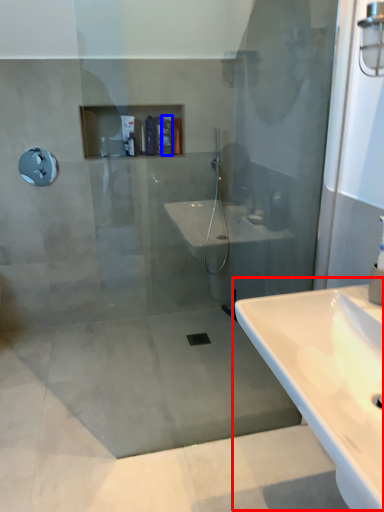
Question: Which of the following is the farthest to the observer, sink (highlighted by a red box) or toiletry (highlighted by a blue box)?

Choices:
 (A) sink
 (B) toiletry

Answer: (B)